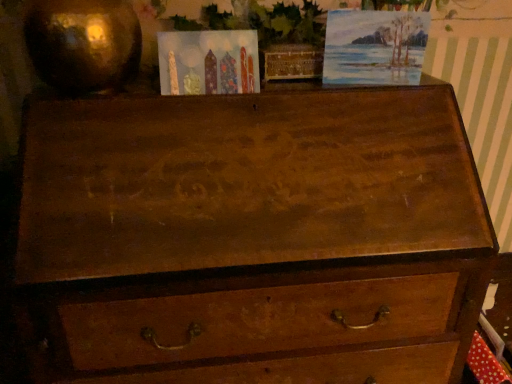
The image size is (512, 384). What do you see at coordinates (208, 62) in the screenshot? I see `matte paper postcard at upper center` at bounding box center [208, 62].

You are a GUI agent. You are given a task and a screenshot of the screen. Output one action in this format:
    pyautogui.click(x=<x>, y=<y>)
    Task: Click on the matte paper postcard at upper center
    Image resolution: width=512 pixels, height=384 pixels.
    Given the screenshot: What is the action you would take?
    pos(208,62)

The image size is (512, 384). What do you see at coordinates (374, 47) in the screenshot?
I see `watercolor paper painting at upper right` at bounding box center [374, 47].

Locate an element on the screen. watercolor paper painting at upper right is located at coordinates (374, 47).

The width and height of the screenshot is (512, 384). Find the location of `matte paper postcard at upper center`. matte paper postcard at upper center is located at coordinates (208, 62).

In the image, is watercolor paper painting at upper right on the left side or the right side of matte paper postcard at upper center?

Based on their positions, watercolor paper painting at upper right is located to the right of matte paper postcard at upper center.

Is watercolor paper painting at upper right positioned in front of matte paper postcard at upper center?

No, the depth of watercolor paper painting at upper right is greater than that of matte paper postcard at upper center.

Is point (351, 14) closer to camera compared to point (184, 42)?

That is False.

From the image's perspective, is watercolor paper painting at upper right positioned above or below matte paper postcard at upper center?

Clearly, from the image's perspective, watercolor paper painting at upper right is above matte paper postcard at upper center.

From a real-world perspective, is watercolor paper painting at upper right physically below matte paper postcard at upper center?

No.

Between watercolor paper painting at upper right and matte paper postcard at upper center, which one has smaller width?

watercolor paper painting at upper right.

Consider the image. Considering the sizes of watercolor paper painting at upper right and matte paper postcard at upper center in the image, is watercolor paper painting at upper right taller or shorter than matte paper postcard at upper center?

Clearly, watercolor paper painting at upper right is taller compared to matte paper postcard at upper center.

Which of these two, watercolor paper painting at upper right or matte paper postcard at upper center, is smaller?

matte paper postcard at upper center.

Is watercolor paper painting at upper right situated inside matte paper postcard at upper center or outside?

watercolor paper painting at upper right is not enclosed by matte paper postcard at upper center.

Is watercolor paper painting at upper right far from matte paper postcard at upper center?

No, watercolor paper painting at upper right is not far from matte paper postcard at upper center.

Is watercolor paper painting at upper right facing away from matte paper postcard at upper center?

No, matte paper postcard at upper center is not at the back of watercolor paper painting at upper right.

How far apart are watercolor paper painting at upper right and matte paper postcard at upper center?

watercolor paper painting at upper right is 8.54 inches away from matte paper postcard at upper center.

Locate an element on the screen. The width and height of the screenshot is (512, 384). picture frame located on the right of matte paper postcard at upper center is located at coordinates (374, 47).

Which object is positioned more to the right, matte paper postcard at upper center or watercolor paper painting at upper right?

watercolor paper painting at upper right is more to the right.

Is matte paper postcard at upper center closer to the viewer compared to watercolor paper painting at upper right?

That is True.

Which is farther, (242,90) or (410,66)?

Point (410,66)

From the image's perspective, between matte paper postcard at upper center and watercolor paper painting at upper right, which one is located above?

watercolor paper painting at upper right.

From a real-world perspective, is matte paper postcard at upper center physically located above or below watercolor paper painting at upper right?

Clearly, from a real-world perspective, matte paper postcard at upper center is below watercolor paper painting at upper right.

Is matte paper postcard at upper center wider or thinner than watercolor paper painting at upper right?

Clearly, matte paper postcard at upper center has more width compared to watercolor paper painting at upper right.

From the picture: In terms of height, does matte paper postcard at upper center look taller or shorter compared to watercolor paper painting at upper right?

matte paper postcard at upper center is shorter than watercolor paper painting at upper right.

Who is smaller, matte paper postcard at upper center or watercolor paper painting at upper right?

matte paper postcard at upper center is smaller.

Is matte paper postcard at upper center situated inside watercolor paper painting at upper right or outside?

matte paper postcard at upper center is located beyond the bounds of watercolor paper painting at upper right.

Is matte paper postcard at upper center next to watercolor paper painting at upper right and touching it?

No, matte paper postcard at upper center is not making contact with watercolor paper painting at upper right.

Could you tell me if matte paper postcard at upper center is turned towards watercolor paper painting at upper right?

No, matte paper postcard at upper center does not turn towards watercolor paper painting at upper right.

How different are the orientations of matte paper postcard at upper center and watercolor paper painting at upper right in degrees?

There is a 8.69-degree angle between the facing directions of matte paper postcard at upper center and watercolor paper painting at upper right.

The width and height of the screenshot is (512, 384). I want to click on postcard below the watercolor paper painting at upper right (from the image's perspective), so click(208, 62).

In order to click on picture frame that is on the right side of matte paper postcard at upper center in this screenshot , I will do `click(374, 47)`.

Identify the location of postcard lying below the watercolor paper painting at upper right (from the image's perspective). (208, 62).